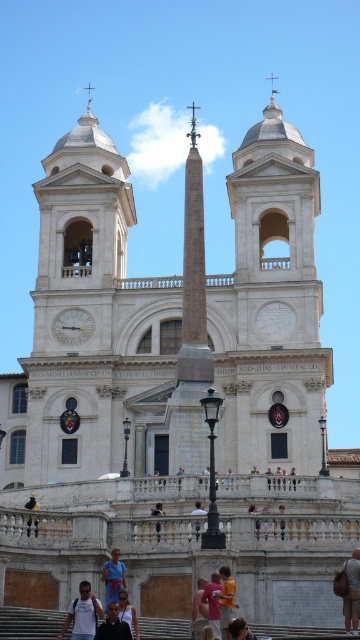
Is denim jacket at lower right above pink fabric shirt at lower center?

No, denim jacket at lower right is not above pink fabric shirt at lower center.

Where is `denim jacket at lower right`? Image resolution: width=360 pixels, height=640 pixels. denim jacket at lower right is located at coordinates (352, 593).

What are the coordinates of `denim jacket at lower right` in the screenshot? It's located at (352, 593).

Where is `denim jacket at lower right`? This screenshot has width=360, height=640. denim jacket at lower right is located at coordinates (352, 593).

The image size is (360, 640). What do you see at coordinates (73, 326) in the screenshot?
I see `white marble clock at center` at bounding box center [73, 326].

Does white marble clock at center have a lesser width compared to dark blue shirt at lower center?

Incorrect, white marble clock at center's width is not less than dark blue shirt at lower center's.

Does point (56, 339) come in front of point (110, 620)?

No.

Locate an element on the screen. The width and height of the screenshot is (360, 640). white marble clock at center is located at coordinates (73, 326).

Is denim jacket at lower right to the left of brown hair at lower center from the viewer's perspective?

In fact, denim jacket at lower right is to the right of brown hair at lower center.

Looking at this image, is denim jacket at lower right positioned behind brown hair at lower center?

Yes.

Who is more distant from viewer, (343, 598) or (240, 634)?

Point (343, 598)

What are the coordinates of `denim jacket at lower right` in the screenshot? It's located at (352, 593).